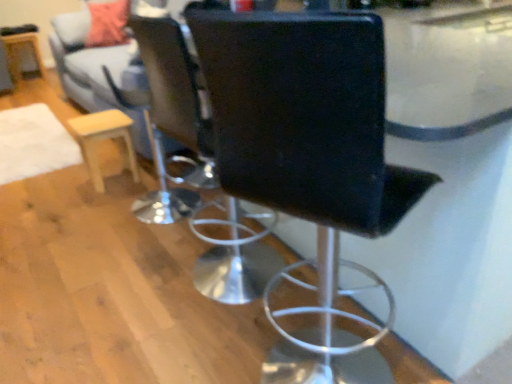
This screenshot has height=384, width=512. What are the coordinates of `vacant space underneath black leather chair at center, the 2th chair positioned from the front (from a real-world perspective)` in the screenshot? It's located at (208, 283).